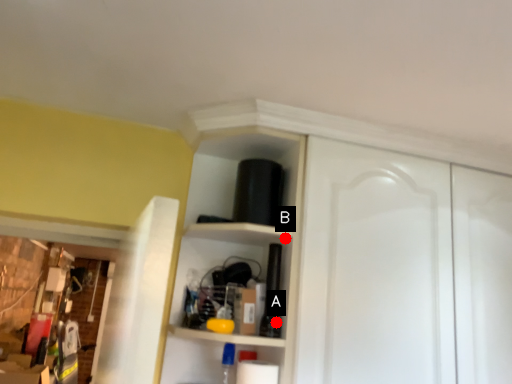
Question: Two points are circled on the image, labeled by A and B beside each circle. Which point is closer to the camera taking this photo?

Choices:
 (A) A is closer
 (B) B is closer

Answer: (A)